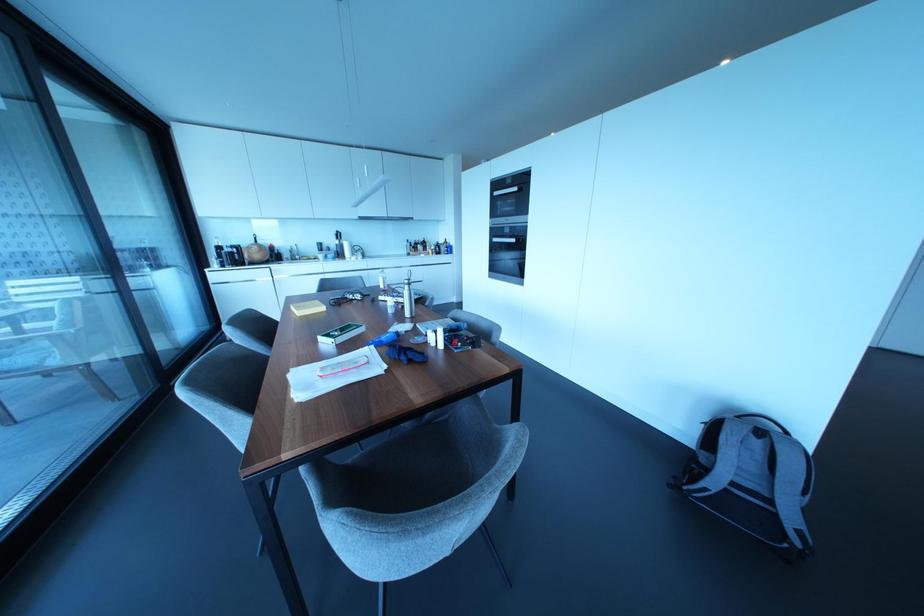
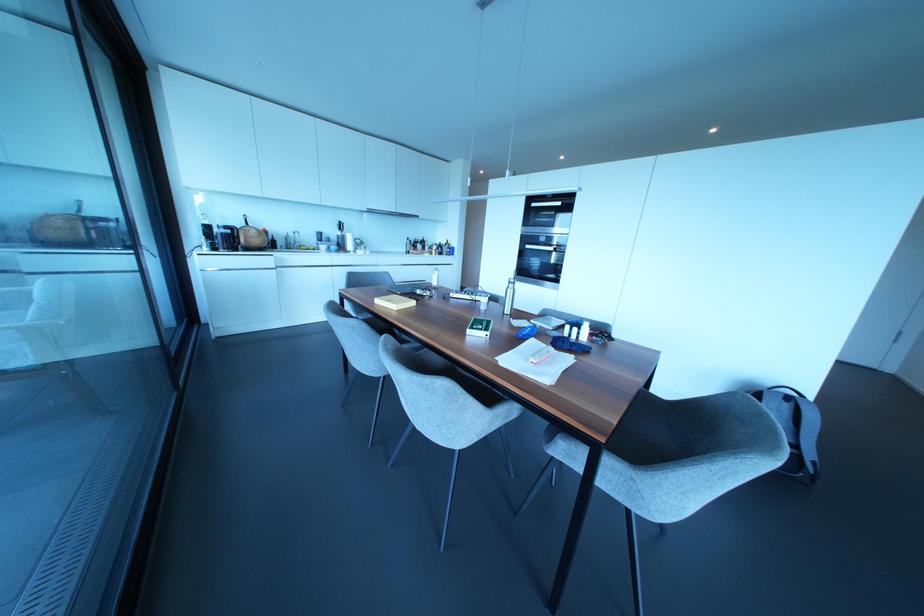
Find the pixel in the second image that matches point (381, 286) in the first image.

(434, 283)